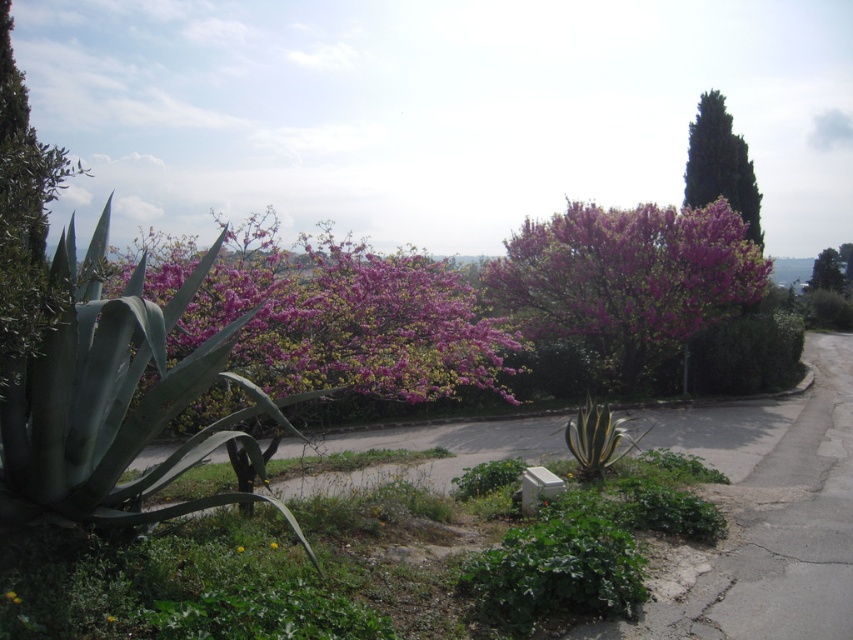
You are standing in the middle of the outdoor scene described. Looking towards the upper right corner of your field of view, can you see the green textured tree at upper right? Please explain based on its position.

The green textured tree at upper right is located at the coordinates (720, 164) in the image, which places it near the upper right corner of the scene. Since you are standing in the middle, looking towards the upper right would allow you to see it clearly.

You are a gardener planning to prune plants in the garden. You need to know which plant requires more attention because it is larger. Which one is bigger between the pink bloom bush at center and the green leafy tree at upper right?

The pink bloom bush at center is bigger than the green leafy tree at upper right, so it requires more attention due to its larger size.

You are standing in the outdoor scene described and want to locate the pink bloom at center. According to the coordinates provided, where would you look to find it?

The pink bloom at center is located at coordinates point (347, 320).